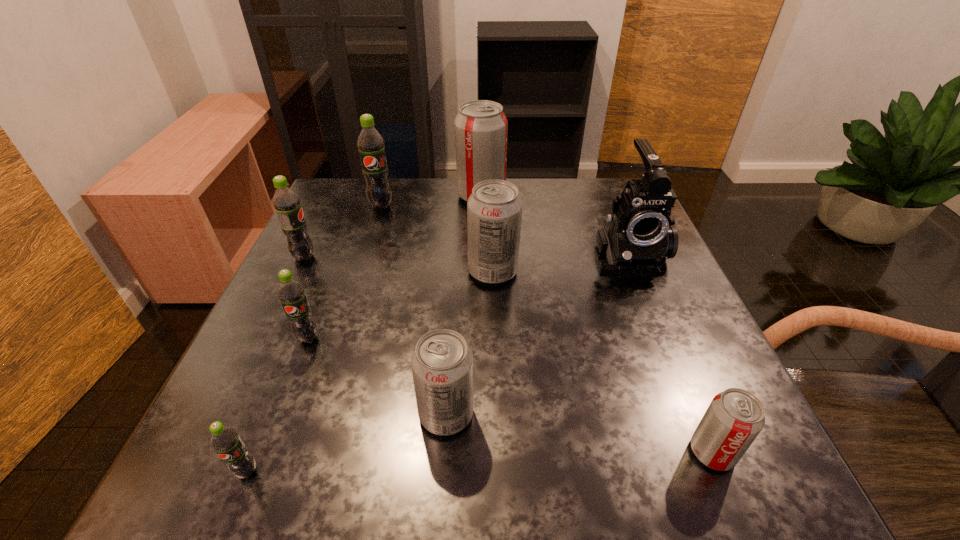
Locate an element on the screen. vacant space situated 0.370m on the left of the rightmost soda can is located at coordinates (432, 452).

At what (x,y) coordinates should I click in order to perform the action: click on camcorder present at the right edge. Please return your answer as a coordinate pair (x, y). The width and height of the screenshot is (960, 540). Looking at the image, I should click on (637, 240).

What are the coordinates of `soda can that is at the right edge` in the screenshot? It's located at (734, 418).

Image resolution: width=960 pixels, height=540 pixels. Identify the location of object that is at the far left corner. (370, 143).

Identify the location of object that is at the near left corner. (226, 442).

In order to click on object that is at the near right corner in this screenshot , I will do `click(734, 418)`.

In the image, there is a desktop. Where is `vacant area at the far edge`? vacant area at the far edge is located at coordinates [420, 191].

This screenshot has height=540, width=960. What are the coordinates of `free spot at the left edge of the desktop` in the screenshot? It's located at (268, 320).

Find the location of `vacant space at the right edge`. vacant space at the right edge is located at coordinates point(680,399).

Find the location of a particular element. Image resolution: width=960 pixels, height=540 pixels. vacant area at the far left corner of the desktop is located at coordinates (352, 194).